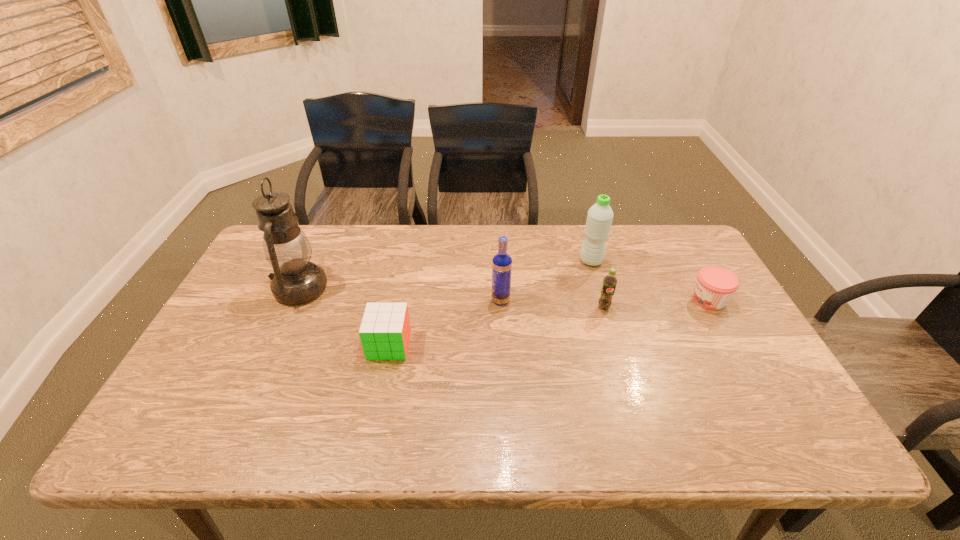
Where is `object located in the right edge section of the desktop`? object located in the right edge section of the desktop is located at coordinates (715, 285).

This screenshot has height=540, width=960. What are the coordinates of `object that is positioned at the far left corner` in the screenshot? It's located at (296, 280).

In the image, there is a desktop. Identify the location of blank space at the far edge. The height and width of the screenshot is (540, 960). (615, 228).

Find the location of a particular element. Image resolution: width=960 pixels, height=540 pixels. vacant area at the near edge of the desktop is located at coordinates (512, 418).

Identify the location of free region at the left edge. (239, 298).

You are a GUI agent. You are given a task and a screenshot of the screen. Output one action in this format:
    pyautogui.click(x=<x>, y=<y>)
    Task: Click on the vacant space at the right edge of the desktop
    This screenshot has width=960, height=540.
    Given the screenshot: What is the action you would take?
    pyautogui.click(x=756, y=364)

This screenshot has width=960, height=540. I want to click on free space at the near right corner, so click(x=798, y=447).

Locate an element on the screen. The height and width of the screenshot is (540, 960). unoccupied area between the cube and the soda is located at coordinates (496, 326).

Locate an element on the screen. free space between the water bottle and the vodka is located at coordinates (546, 281).

The image size is (960, 540). I want to click on vacant area that lies between the soda and the tallest object, so click(x=452, y=298).